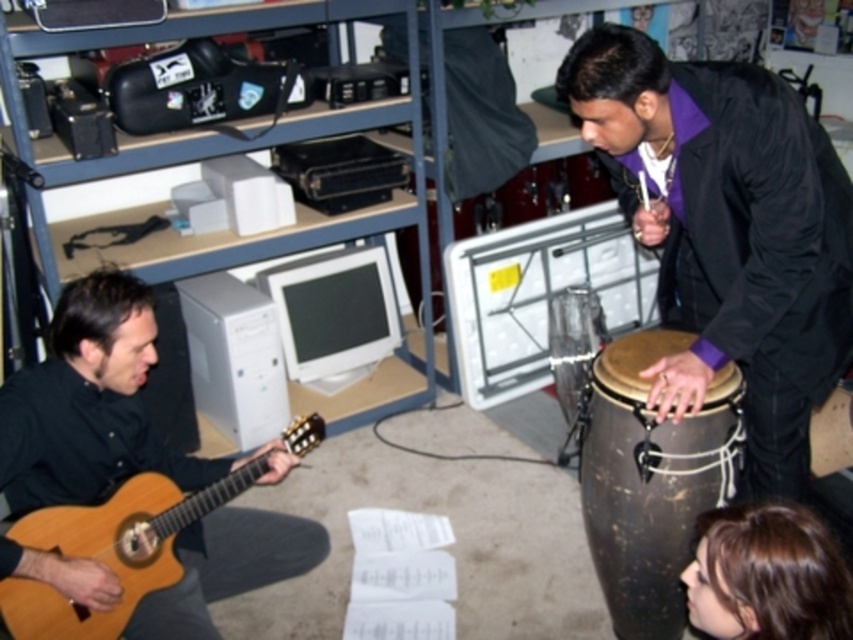
Question: Can you confirm if light brown wooden guitar at lower left is positioned above white plastic computer tower at center?

Choices:
 (A) no
 (B) yes

Answer: (A)

Question: Which of the following is the closest to the observer?

Choices:
 (A) (809, 220)
 (B) (659, 474)

Answer: (A)

Question: Which object is closer to the camera taking this photo?

Choices:
 (A) light brown wooden guitar at lower left
 (B) white glossy monitor at center

Answer: (A)

Question: Does brown leather drum at lower center appear on the left side of white glossy monitor at center?

Choices:
 (A) no
 (B) yes

Answer: (A)

Question: Estimate the real-world distances between objects in this image. Which object is closer to the brown leather drum at lower center?

Choices:
 (A) shiny black jacket at right
 (B) light brown wooden guitar at lower left
 (C) white plastic computer tower at center
 (D) white glossy monitor at center

Answer: (A)

Question: Is shiny black jacket at right below white glossy monitor at center?

Choices:
 (A) no
 (B) yes

Answer: (A)